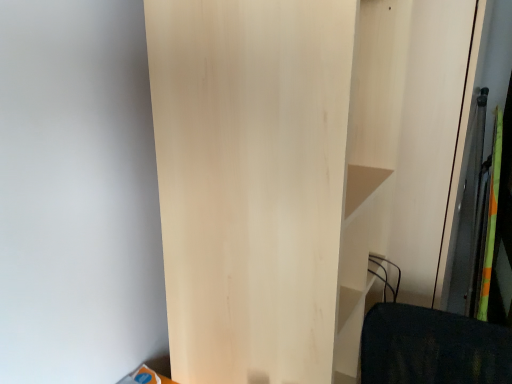
Describe the element at coordinates (298, 172) in the screenshot. Image resolution: width=512 pixels, height=384 pixels. I see `light wood dresser at center` at that location.

At what (x,y) coordinates should I click in order to perform the action: click on light wood dresser at center. Please return your answer as a coordinate pair (x, y). The image size is (512, 384). Looking at the image, I should click on (298, 172).

Locate an element on the screen. This screenshot has width=512, height=384. light wood dresser at center is located at coordinates (298, 172).